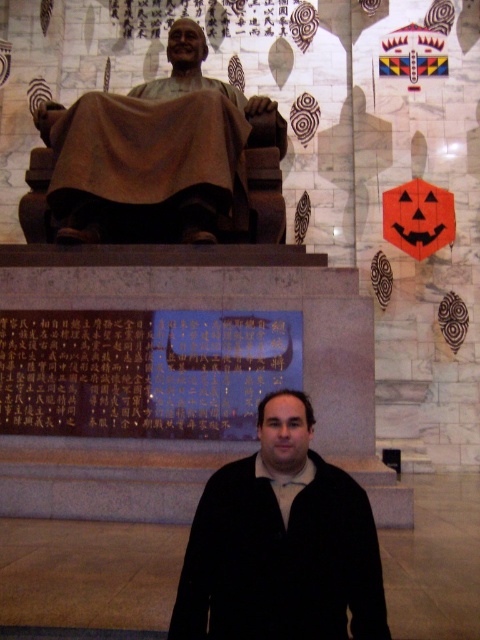
Can you confirm if black matte jacket at center is smaller than bronze statue at center?

Indeed, black matte jacket at center has a smaller size compared to bronze statue at center.

Which is more to the right, black matte jacket at center or bronze statue at center?

From the viewer's perspective, black matte jacket at center appears more on the right side.

Who is more distant from viewer, (x=357, y=524) or (x=215, y=234)?

Positioned behind is point (x=215, y=234).

This screenshot has height=640, width=480. In order to click on black matte jacket at center in this screenshot , I will do point(280,544).